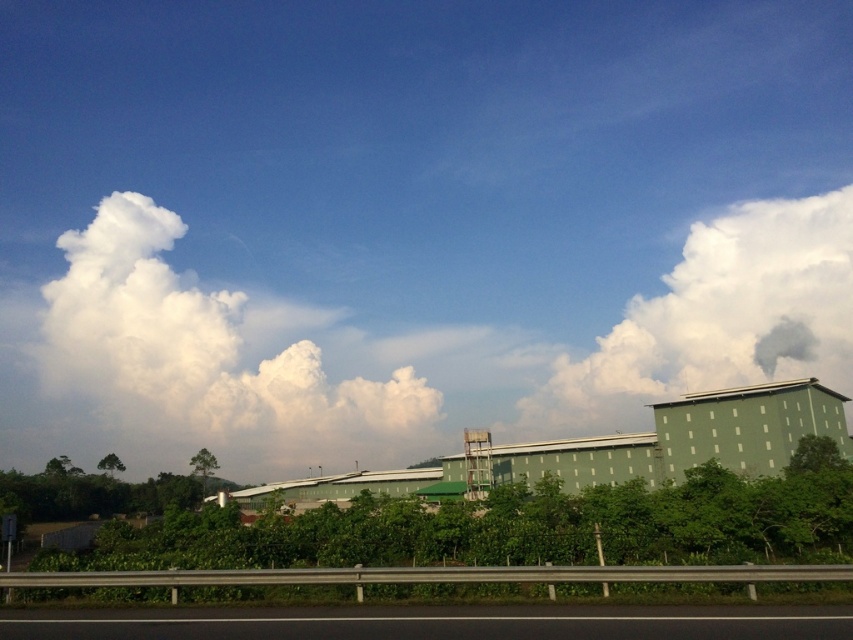
Question: Is white fluffy cloud at upper left bigger than black asphalt highway at lower center?

Choices:
 (A) yes
 (B) no

Answer: (A)

Question: Which is farther from the black asphalt highway at lower center?

Choices:
 (A) white fluffy cloud at upper left
 (B) white fluffy cloud at upper right

Answer: (A)

Question: In this image, where is white fluffy cloud at upper left located relative to white fluffy cloud at upper right?

Choices:
 (A) below
 (B) above

Answer: (A)

Question: Which of the following is the closest to the observer?

Choices:
 (A) (196, 442)
 (B) (769, 212)
 (C) (3, 612)

Answer: (C)

Question: Is white fluffy cloud at upper left bigger than white fluffy cloud at upper right?

Choices:
 (A) no
 (B) yes

Answer: (A)

Question: Which is nearer to the white fluffy cloud at upper left?

Choices:
 (A) black asphalt highway at lower center
 (B) white fluffy cloud at upper right

Answer: (B)